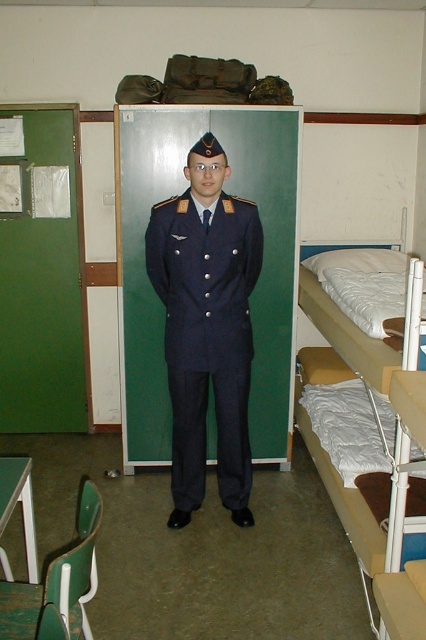
Does navy blue uniform at center have a greater width compared to white fabric bunk bed at right?

Yes.

Does navy blue uniform at center appear on the left side of white fabric bunk bed at right?

Correct, you'll find navy blue uniform at center to the left of white fabric bunk bed at right.

Which is in front, point (163, 262) or point (394, 467)?

Point (394, 467) is in front.

You are a GUI agent. You are given a task and a screenshot of the screen. Output one action in this format:
    pyautogui.click(x=<x>, y=<y>)
    Task: Click on the navy blue uniform at center
    This screenshot has height=640, width=426.
    Given the screenshot: What is the action you would take?
    pyautogui.click(x=207, y=337)